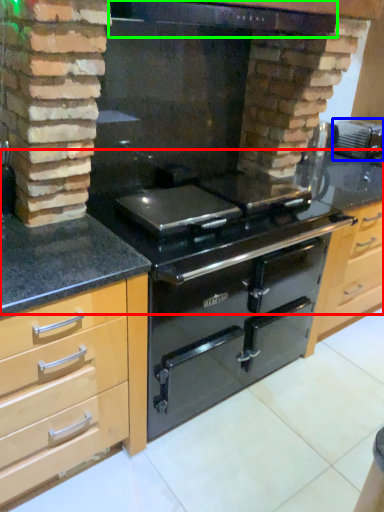
Question: Which object is the closest to the counter top (highlighted by a red box)? Choose among these: appliance (highlighted by a blue box) or exhaust hood (highlighted by a green box).

Choices:
 (A) appliance
 (B) exhaust hood

Answer: (B)